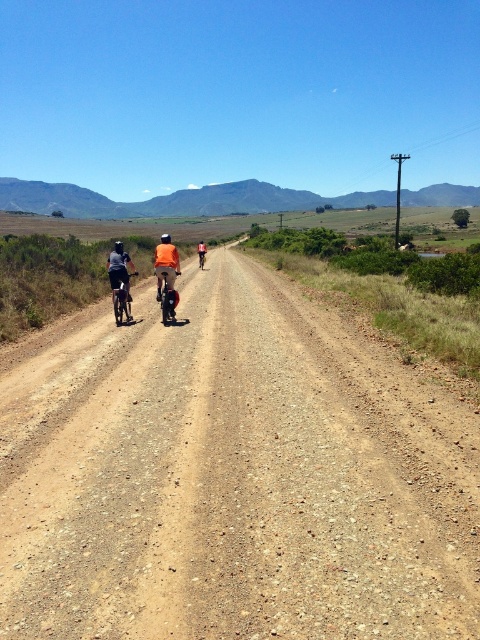
Is point (167, 280) farther from viewer compared to point (160, 307)?

No, it is in front of (160, 307).

Between orange fabric jacket at center and shiny metallic bicycle at center, which one is positioned lower?

shiny metallic bicycle at center is below.

Is point (170, 257) in front of point (166, 282)?

No, (170, 257) is behind (166, 282).

Find the location of a particular element. The height and width of the screenshot is (640, 480). orange fabric jacket at center is located at coordinates (166, 262).

Is brown gravel road at center taller than matte black bicycle at left?

Indeed, brown gravel road at center has a greater height compared to matte black bicycle at left.

This screenshot has width=480, height=640. Identify the location of brown gravel road at center. (236, 477).

Is point (164, 285) farther from camera compared to point (120, 278)?

Yes.

Is shiny metallic bicycle at center bigger than matte black bicycle at left?

Incorrect, shiny metallic bicycle at center is not larger than matte black bicycle at left.

Describe the element at coordinates (167, 296) in the screenshot. The height and width of the screenshot is (640, 480). I see `shiny metallic bicycle at center` at that location.

Image resolution: width=480 pixels, height=640 pixels. I want to click on shiny metallic bicycle at center, so click(x=167, y=296).